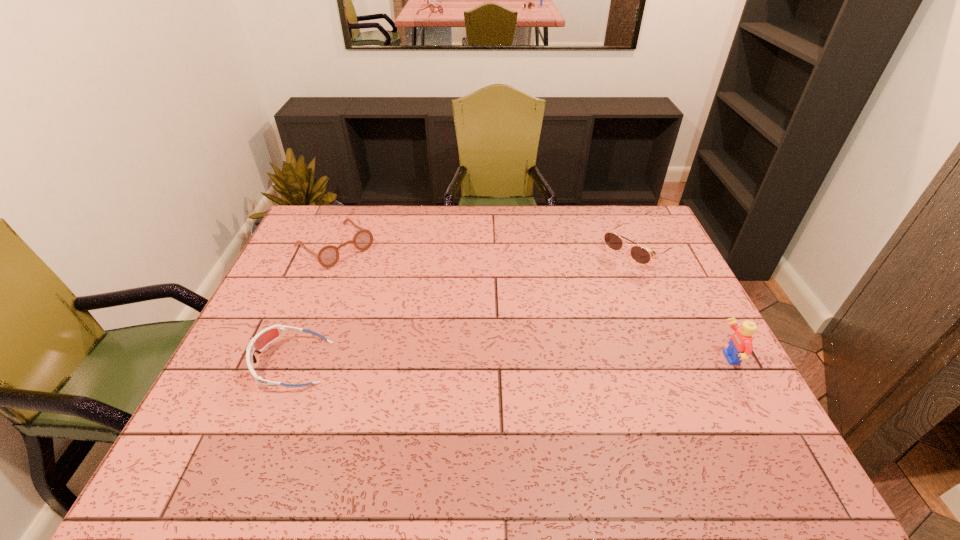
Locate an element on the screen. vacant space on the desktop that is between the goggles and the tallest object and is positioned on the front-facing side of the spectacles is located at coordinates (471, 361).

At what (x,y) coordinates should I click in order to perform the action: click on free spot on the desktop that is between the goggles and the tallest object and is positioned on the front lenses of the sunglasses. Please return your answer as a coordinate pair (x, y). The width and height of the screenshot is (960, 540). Looking at the image, I should click on (494, 361).